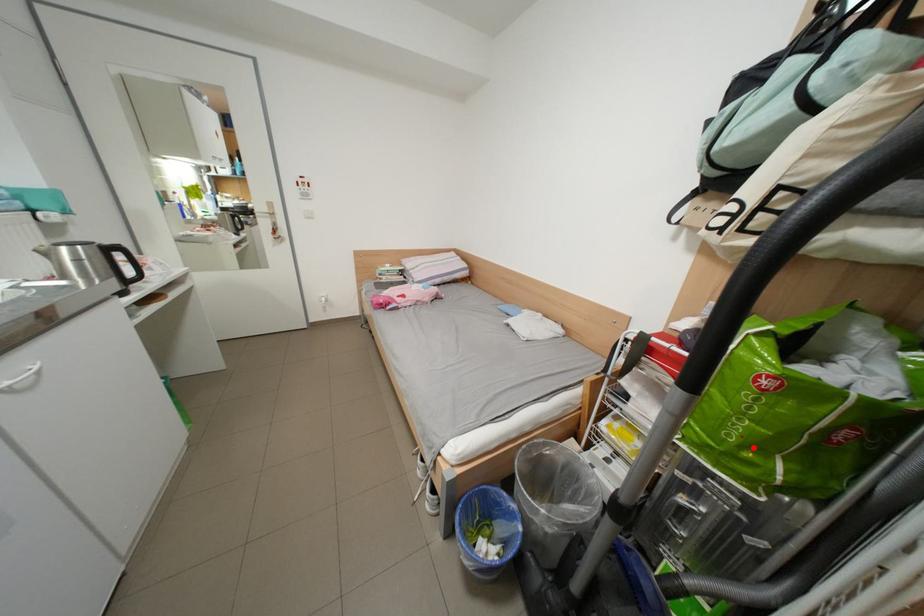
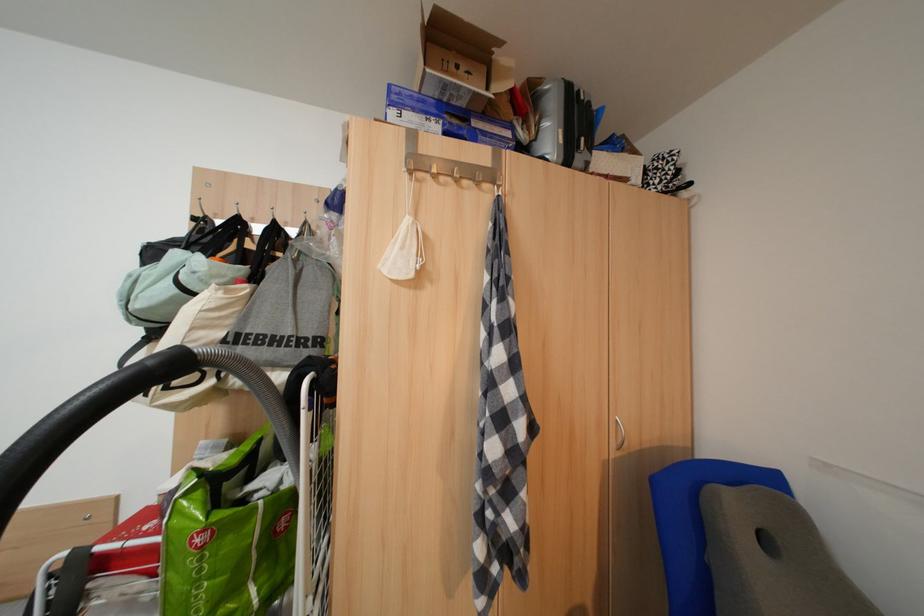
Question: I am providing you with two images of the same scene from different viewpoints. Given a red point in image1, look at the same physical point in image2. Is it:

Choices:
 (A) Closer to the viewpoint
 (B) Farther from the viewpoint

Answer: (A)